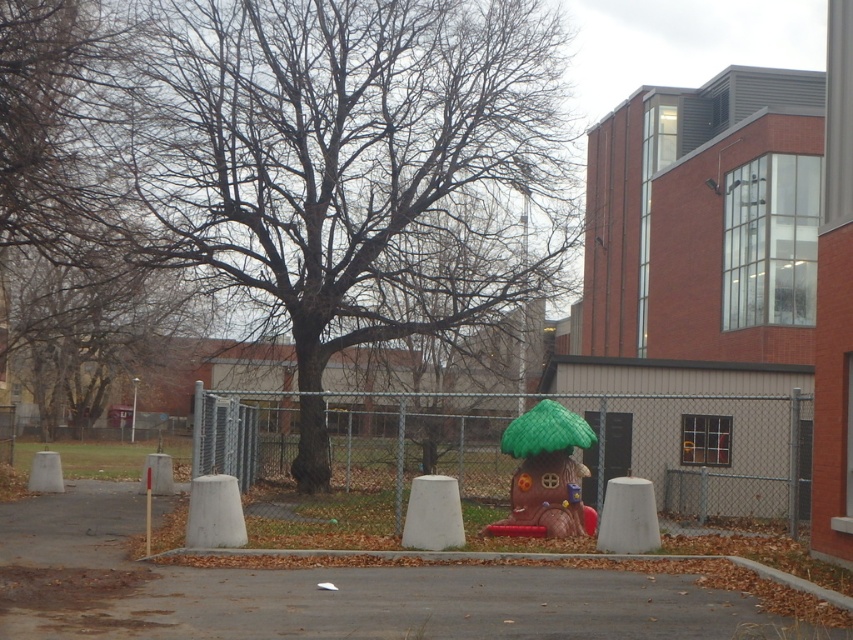
Question: Is gray asphalt pavement at center to the right of gray chain-link fence at center from the viewer's perspective?

Choices:
 (A) yes
 (B) no

Answer: (B)

Question: Which point is closer to the camera?

Choices:
 (A) (531, 620)
 (B) (796, 525)

Answer: (A)

Question: Which object appears farthest from the camera in this image?

Choices:
 (A) gray asphalt pavement at center
 (B) gray chain-link fence at center

Answer: (B)

Question: Is gray asphalt pavement at center thinner than gray chain-link fence at center?

Choices:
 (A) yes
 (B) no

Answer: (B)

Question: Can you confirm if gray asphalt pavement at center is positioned to the right of gray chain-link fence at center?

Choices:
 (A) yes
 (B) no

Answer: (B)